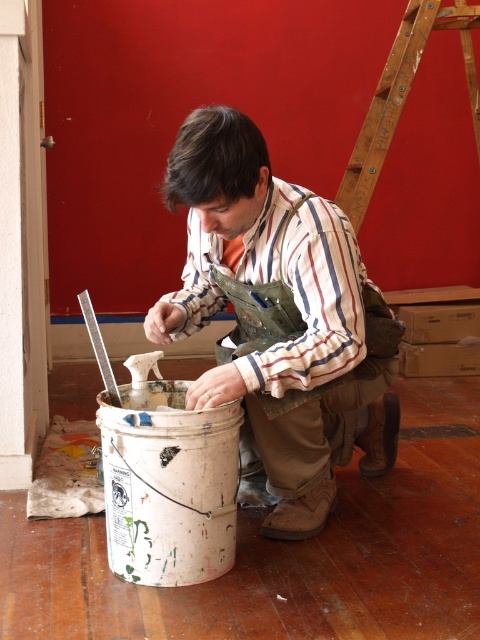
Question: Is matte striped shirt at center above wooden ladder at upper right?

Choices:
 (A) yes
 (B) no

Answer: (B)

Question: Can you confirm if matte striped shirt at center is positioned above wooden ladder at upper right?

Choices:
 (A) yes
 (B) no

Answer: (B)

Question: Which point appears closest to the camera in this image?

Choices:
 (A) (268, 442)
 (B) (469, 22)

Answer: (A)

Question: Among these objects, which one is farthest from the camera?

Choices:
 (A) wooden ladder at upper right
 (B) matte striped shirt at center

Answer: (A)

Question: Is the position of matte striped shirt at center less distant than that of wooden ladder at upper right?

Choices:
 (A) no
 (B) yes

Answer: (B)

Question: Which object is closer to the camera taking this photo?

Choices:
 (A) matte striped shirt at center
 (B) wooden ladder at upper right

Answer: (A)